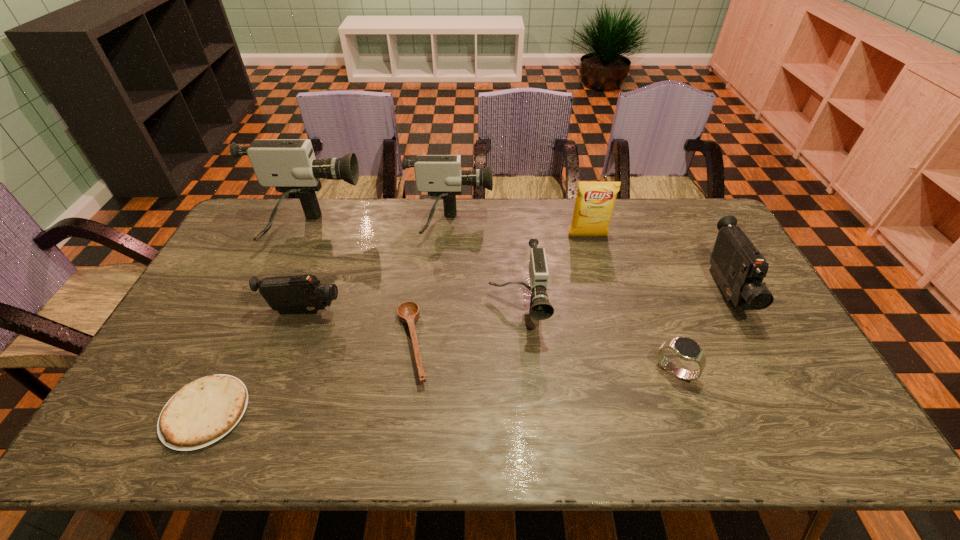
The height and width of the screenshot is (540, 960). Find the location of `vacant position located on the front-facing side of the left black camcorder`. vacant position located on the front-facing side of the left black camcorder is located at coordinates (360, 312).

Image resolution: width=960 pixels, height=540 pixels. Find the location of `blank space located on the back of the seventh tallest object`. blank space located on the back of the seventh tallest object is located at coordinates click(x=657, y=321).

Find the location of a particular element. The height and width of the screenshot is (540, 960). vacant space located 0.390m on the back of the eighth tallest object is located at coordinates (428, 225).

Image resolution: width=960 pixels, height=540 pixels. Find the location of `free location located 0.380m on the right of the tortilla`. free location located 0.380m on the right of the tortilla is located at coordinates (404, 413).

Where is `crisp (potato chip) located in the far edge section of the desktop`? crisp (potato chip) located in the far edge section of the desktop is located at coordinates (x=595, y=201).

The image size is (960, 540). In order to click on object situated at the near edge in this screenshot , I will do `click(202, 412)`.

This screenshot has width=960, height=540. Identify the location of camcorder present at the left edge. (289, 165).

This screenshot has height=540, width=960. Find the location of `tortilla present at the left edge`. tortilla present at the left edge is located at coordinates (202, 412).

You are a GUI agent. You are given a task and a screenshot of the screen. Output one action in this format:
    pyautogui.click(x=<x>, y=<y>)
    Task: Click on the object at the right edge
    The height and width of the screenshot is (540, 960).
    Given the screenshot: What is the action you would take?
    point(738,267)

Identify the location of object at the far left corner. (289, 165).